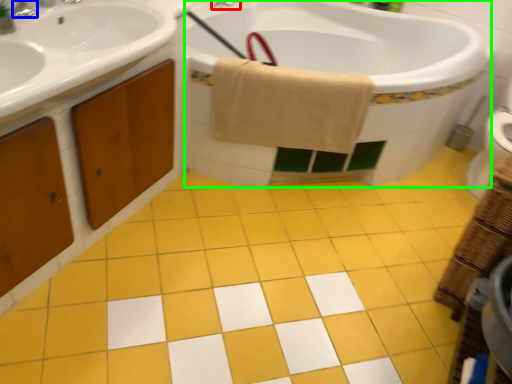
Question: Which is nearer to the tap (highlighted by a red box)? tap (highlighted by a blue box) or bath (highlighted by a green box).

Choices:
 (A) tap
 (B) bath

Answer: (B)